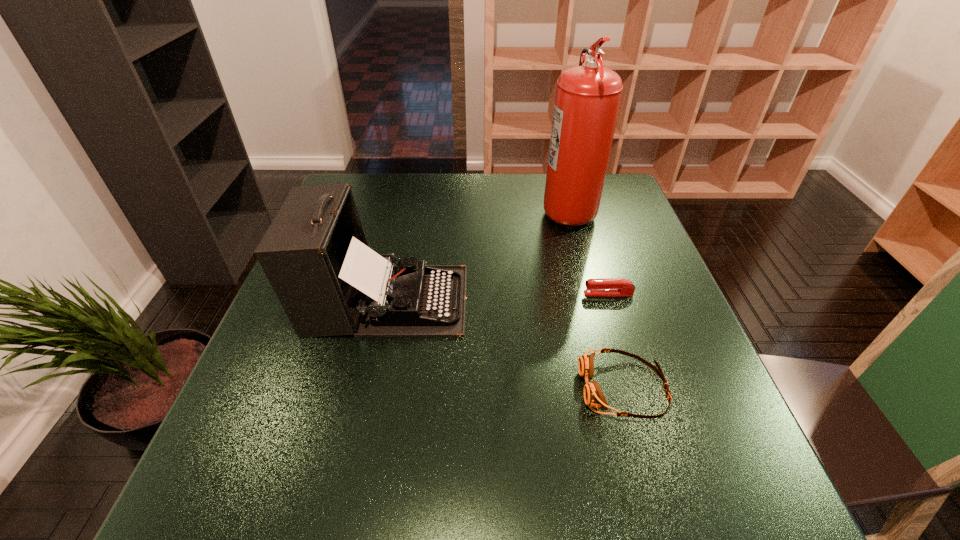
I want to click on vacant area that lies between the goggles and the stapler, so click(616, 341).

The height and width of the screenshot is (540, 960). Identify the location of free space between the stapler and the fire extinguisher. (588, 251).

Locate an element on the screen. This screenshot has width=960, height=540. blank region between the second shortest object and the fire extinguisher is located at coordinates click(x=595, y=298).

You are a GUI agent. You are given a task and a screenshot of the screen. Output one action in this format:
    pyautogui.click(x=<x>, y=<y>)
    Task: Click on the free space that is in between the leftmost object and the goggles
    The width and height of the screenshot is (960, 540).
    Given the screenshot: What is the action you would take?
    pyautogui.click(x=505, y=344)

Image resolution: width=960 pixels, height=540 pixels. Find the location of `vacant area between the nearest object and the fire extinguisher`. vacant area between the nearest object and the fire extinguisher is located at coordinates [595, 298].

This screenshot has width=960, height=540. Identify the location of free space between the stapler and the tallest object. (588, 251).

Identify the location of free space between the second tallest object and the farthest object. The width and height of the screenshot is (960, 540). (477, 254).

You are a GUI agent. You are given a task and a screenshot of the screen. Output one action in this format:
    pyautogui.click(x=<x>, y=<y>)
    Task: Click on the vacant area that lies between the leftmost object and the stapler
    The height and width of the screenshot is (540, 960).
    Given the screenshot: What is the action you would take?
    pyautogui.click(x=497, y=297)

Find the location of a particular element. Image resolution: width=960 pixels, height=540 pixels. object that stands as the third closest to the farthest object is located at coordinates (593, 396).

Locate an element on the screen. object that is the closest to the tallest object is located at coordinates (604, 286).